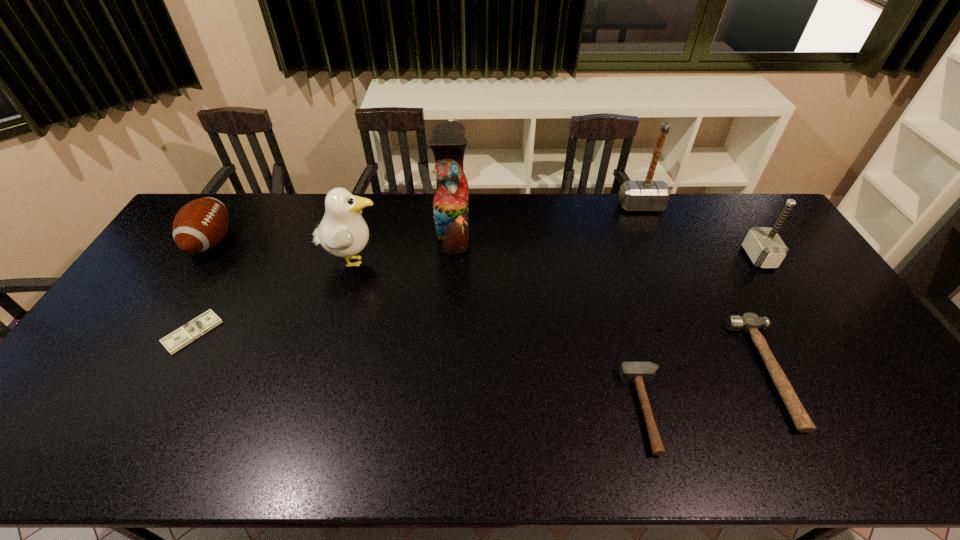
This screenshot has height=540, width=960. Identify the location of free spot located 0.260m on the striking face of the second object from right to left. (647, 372).

Identify the location of vacant space located 0.220m on the striking surface of the leftmost hammer. (538, 410).

This screenshot has width=960, height=540. I want to click on free location located 0.090m on the striking surface of the leftmost hammer, so click(591, 410).

The image size is (960, 540). I want to click on vacant space located 0.220m on the striking surface of the leftmost hammer, so click(538, 410).

Locate an element on the screen. This screenshot has height=540, width=960. free location located 0.180m on the left of the shortest object is located at coordinates (103, 332).

Where is `parrot that is at the far edge`? This screenshot has height=540, width=960. parrot that is at the far edge is located at coordinates (450, 205).

I want to click on hammer located at the far edge, so click(x=648, y=195).

The height and width of the screenshot is (540, 960). In order to click on football positioned at the far edge in this screenshot , I will do `click(199, 225)`.

Identify the location of object at the left edge. The width and height of the screenshot is (960, 540). (199, 225).

Where is `object that is positioned at the right edge`? object that is positioned at the right edge is located at coordinates (763, 245).